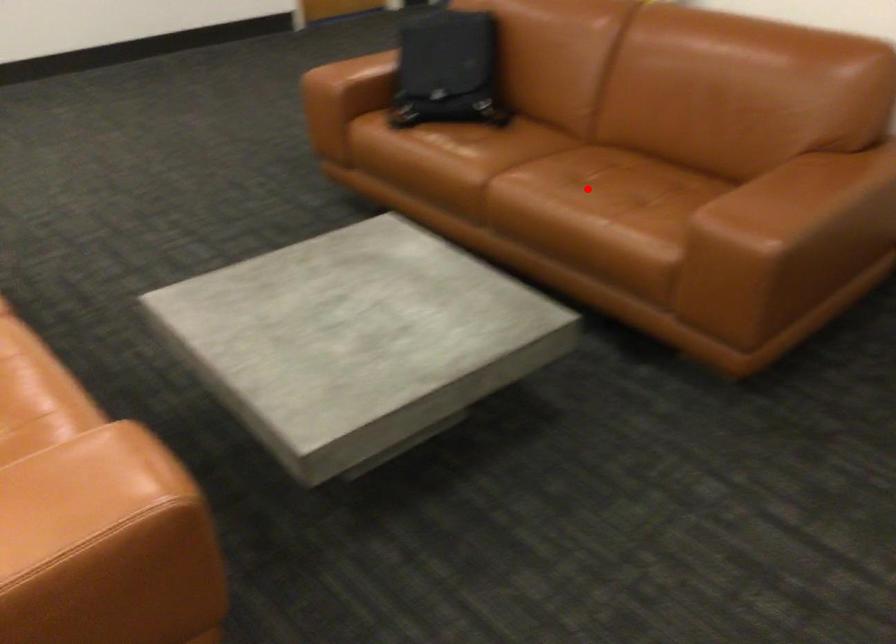
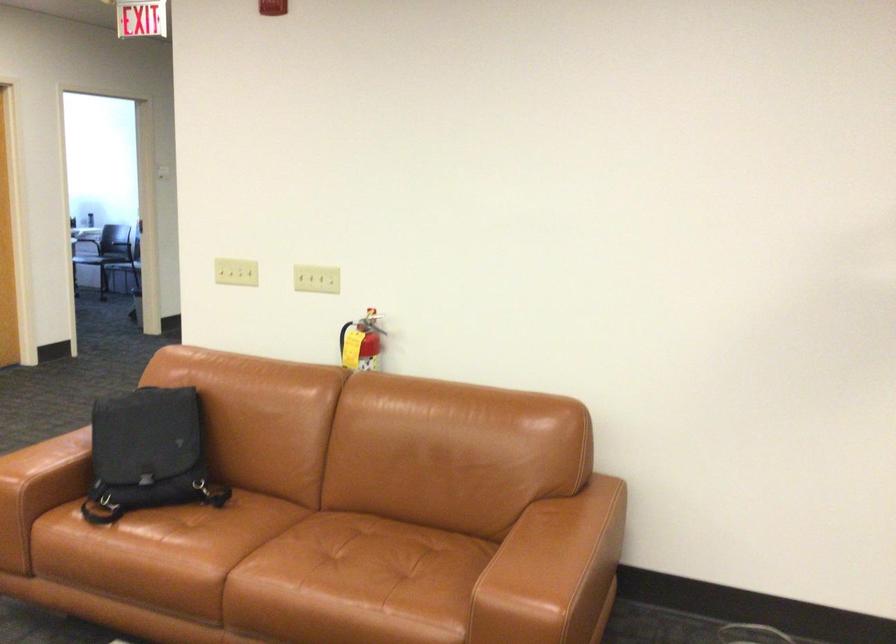
Where in the second image is the point corresponding to the highlighted location from the first image?

(350, 574)